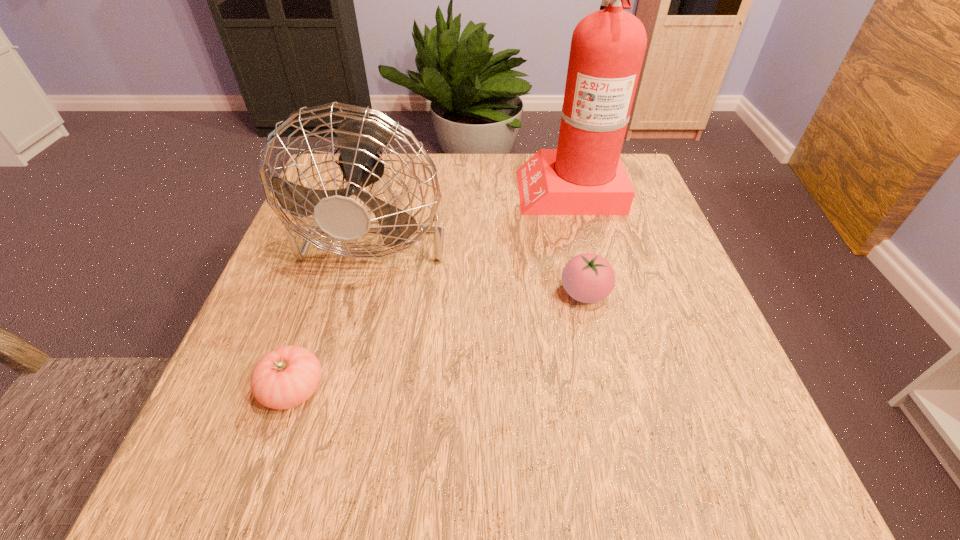
What are the coordinates of `vacant space at the near edge of the desktop` in the screenshot? It's located at (533, 488).

You are a GUI agent. You are given a task and a screenshot of the screen. Output one action in this format:
    pyautogui.click(x=<x>, y=<y>)
    Task: Click on the vacant space at the left edge of the desktop
    
    Given the screenshot: What is the action you would take?
    pyautogui.click(x=316, y=316)

The width and height of the screenshot is (960, 540). What are the coordinates of `vacant space at the right edge` in the screenshot? It's located at (650, 280).

Where is `free region at the far right corner`? Image resolution: width=960 pixels, height=540 pixels. free region at the far right corner is located at coordinates (633, 168).

This screenshot has height=540, width=960. I want to click on vacant space at the near right corner of the desktop, so click(722, 446).

At what (x,y) coordinates should I click in order to perform the action: click on vacant area between the fan and the tallest object. Please return your answer as a coordinate pair (x, y). Image resolution: width=960 pixels, height=540 pixels. Looking at the image, I should click on (474, 207).

Where is `vacant region between the shortest object and the second shortest object`? vacant region between the shortest object and the second shortest object is located at coordinates (439, 341).

The height and width of the screenshot is (540, 960). In order to click on free space between the shortest object and the second shortest object in this screenshot , I will do `click(439, 341)`.

I want to click on vacant point located between the right tomato and the third shortest object, so click(x=482, y=259).

The height and width of the screenshot is (540, 960). I want to click on vacant area between the tallest object and the third shortest object, so click(474, 207).